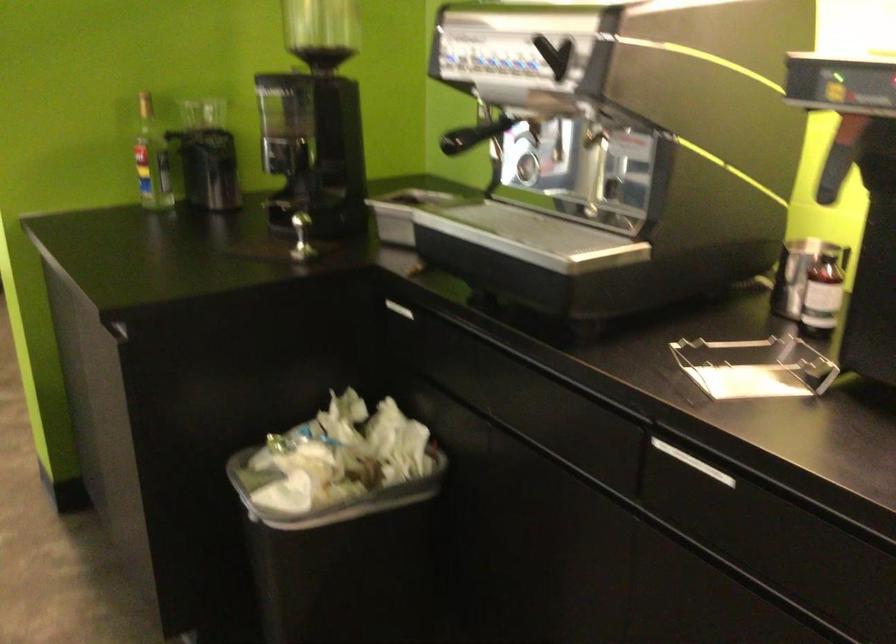
Locate an element on the screen. small dark bottle is located at coordinates (822, 294).